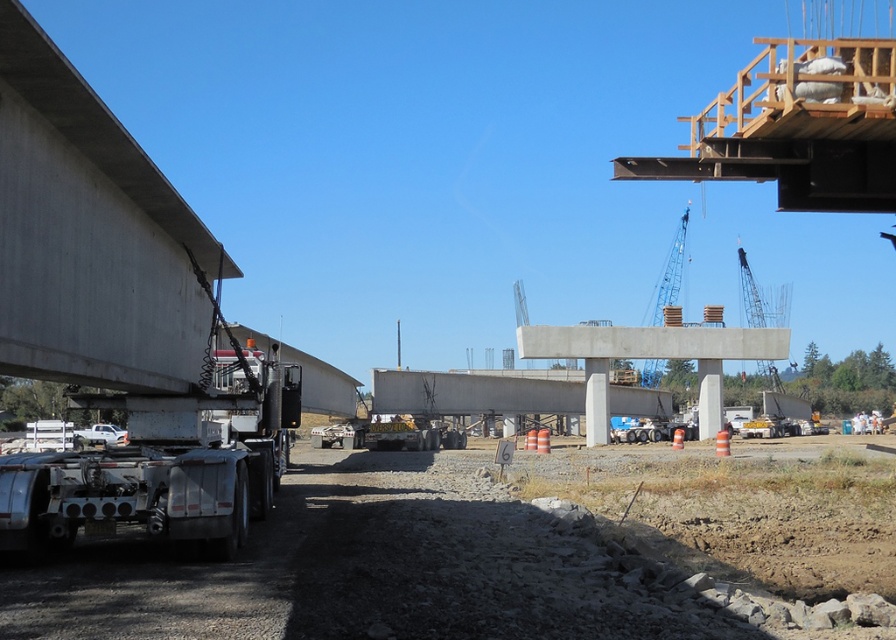
Is smooth concrete overpass at left taller than concrete at center?

In fact, smooth concrete overpass at left may be shorter than concrete at center.

Where is `smooth concrete overpass at left`? smooth concrete overpass at left is located at coordinates (88, 234).

Measure the distance between concrete at center and blue metallic crane at upper center.

The distance of concrete at center from blue metallic crane at upper center is 36.72 meters.

Is concrete at center above blue metallic crane at upper center?

No, concrete at center is not above blue metallic crane at upper center.

Does point (444, 396) lie behind point (665, 276)?

No, it is not.

At what (x,y) coordinates should I click in order to perform the action: click on concrete at center. Please return your answer as a coordinate pair (x, y). The image size is (896, 640). Looking at the image, I should click on (475, 392).

Which is above, silver metallic trailer truck at left or blue metallic crane at upper center?

blue metallic crane at upper center

Image resolution: width=896 pixels, height=640 pixels. Find the location of `silver metallic trailer truck at left`. silver metallic trailer truck at left is located at coordinates (162, 465).